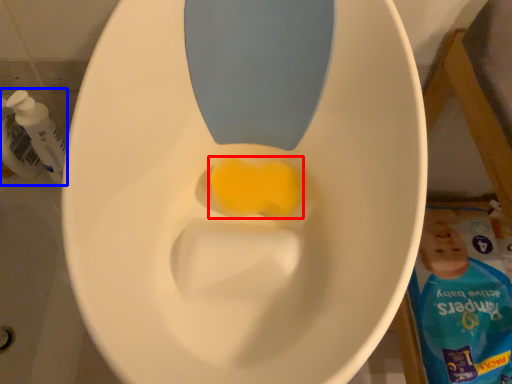
Question: Which object appears closest to the camera in this image, food (highlighted by a red box) or cleaning product (highlighted by a blue box)?

Choices:
 (A) food
 (B) cleaning product

Answer: (A)